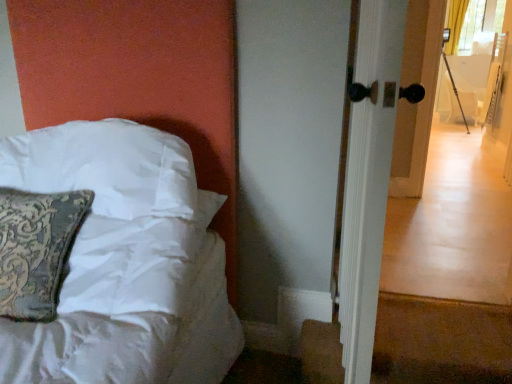
Question: Can you see white satin pillow at left touching white glossy door handle at right?

Choices:
 (A) yes
 (B) no

Answer: (B)

Question: Does white satin pillow at left have a greater width compared to white glossy door handle at right?

Choices:
 (A) yes
 (B) no

Answer: (A)

Question: Can you confirm if white satin pillow at left is bigger than white glossy door handle at right?

Choices:
 (A) no
 (B) yes

Answer: (A)

Question: From a real-world perspective, is white satin pillow at left below white glossy door handle at right?

Choices:
 (A) yes
 (B) no

Answer: (A)

Question: Could white glossy door handle at right be considered to be inside white satin pillow at left?

Choices:
 (A) no
 (B) yes

Answer: (A)

Question: Based on their sizes in the image, would you say white glossy door handle at right is bigger or smaller than white fabric armchair at right?

Choices:
 (A) big
 (B) small

Answer: (B)

Question: Based on their positions, is white glossy door handle at right located to the left or right of white fabric armchair at right?

Choices:
 (A) right
 (B) left

Answer: (B)

Question: Is white glossy door handle at right inside or outside of white fabric armchair at right?

Choices:
 (A) outside
 (B) inside

Answer: (A)

Question: From their relative heights in the image, would you say white glossy door handle at right is taller or shorter than white fabric armchair at right?

Choices:
 (A) tall
 (B) short

Answer: (A)

Question: From a real-world perspective, relative to white satin pillow at left, is white glossy door handle at right vertically above or below?

Choices:
 (A) above
 (B) below

Answer: (A)

Question: In the image, is white glossy door handle at right positioned in front of or behind white satin pillow at left?

Choices:
 (A) front
 (B) behind

Answer: (A)

Question: Would you say white glossy door handle at right is to the left or to the right of white satin pillow at left in the picture?

Choices:
 (A) right
 (B) left

Answer: (A)

Question: In terms of width, does white glossy door handle at right look wider or thinner when compared to white satin pillow at left?

Choices:
 (A) thin
 (B) wide

Answer: (A)

Question: Is white fabric armchair at right situated inside white satin pillow at left or outside?

Choices:
 (A) outside
 (B) inside

Answer: (A)

Question: Based on their sizes in the image, would you say white fabric armchair at right is bigger or smaller than white satin pillow at left?

Choices:
 (A) big
 (B) small

Answer: (A)